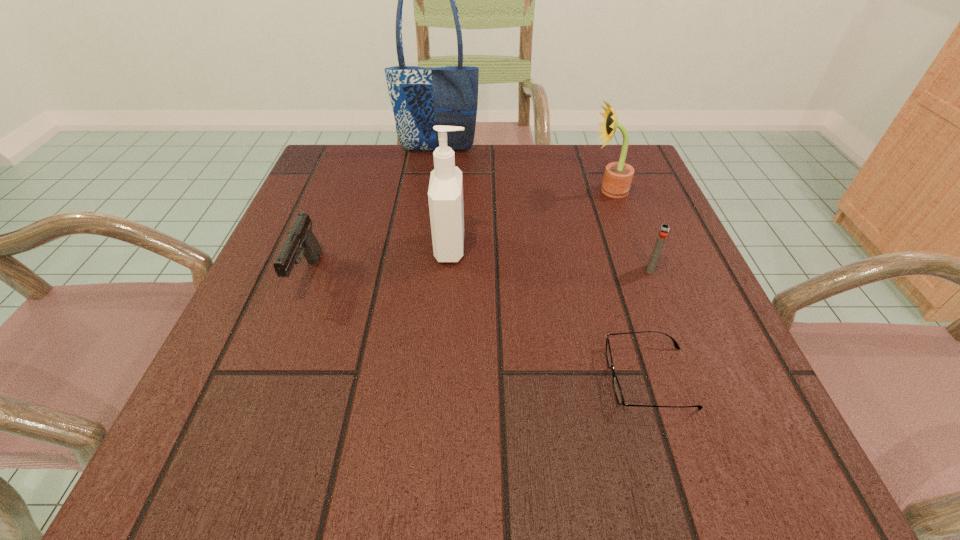
This screenshot has height=540, width=960. I want to click on free space between the shopping bag and the spectacles, so click(543, 264).

You are a GUI agent. You are given a task and a screenshot of the screen. Output one action in this format:
    pyautogui.click(x=<x>, y=<y>)
    Task: Click on the free spot between the fifth nearest object and the farthest object
    Image resolution: width=960 pixels, height=540 pixels.
    Given the screenshot: What is the action you would take?
    tap(523, 171)

Where is `unoccupied position between the shopping bag and the pistol`? The width and height of the screenshot is (960, 540). unoccupied position between the shopping bag and the pistol is located at coordinates (372, 213).

The image size is (960, 540). I want to click on object that is the second closest to the spectacles, so click(x=445, y=194).

Select which object appears as the closest to the sunflower. Please provide its 2D coordinates. Your answer should be formatted as a tuple, i.e. [(x, y)], where the tuple contains the x and y coordinates of a point satisfying the conditions above.

[(663, 232)]

Where is `vacant position in the image that satisfies the following two spatial constraints: 1. on the face of the sunflower; 2. aim along the barrel of the leftmost object`? vacant position in the image that satisfies the following two spatial constraints: 1. on the face of the sunflower; 2. aim along the barrel of the leftmost object is located at coordinates (639, 276).

In order to click on vacant region that satisfies the following two spatial constraints: 1. on the front-facing side of the farthest object; 2. on the right side of the igniter in this screenshot , I will do `click(421, 269)`.

The image size is (960, 540). I want to click on free location that satisfies the following two spatial constraints: 1. on the front label of the igniter; 2. on the left side of the cleansing agent, so click(x=449, y=269).

You are a GUI agent. You are given a task and a screenshot of the screen. Output one action in this format:
    pyautogui.click(x=<x>, y=<y>)
    Task: Click on the blank area in the image that satisfies the following two spatial constraints: 1. on the face of the sunflower; 2. aim along the barrel of the leftmost object
    Image resolution: width=960 pixels, height=540 pixels.
    Given the screenshot: What is the action you would take?
    pyautogui.click(x=639, y=276)